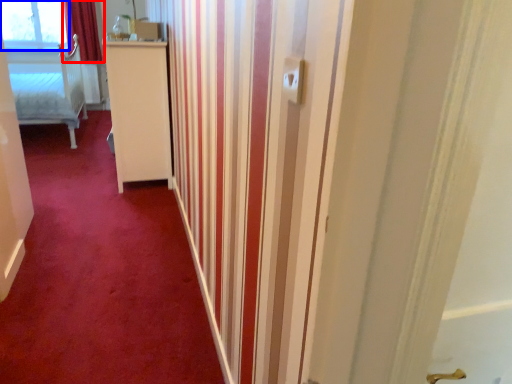
Question: Which of the following is the farthest to the observer, curtain (highlighted by a red box) or window (highlighted by a blue box)?

Choices:
 (A) curtain
 (B) window

Answer: (B)